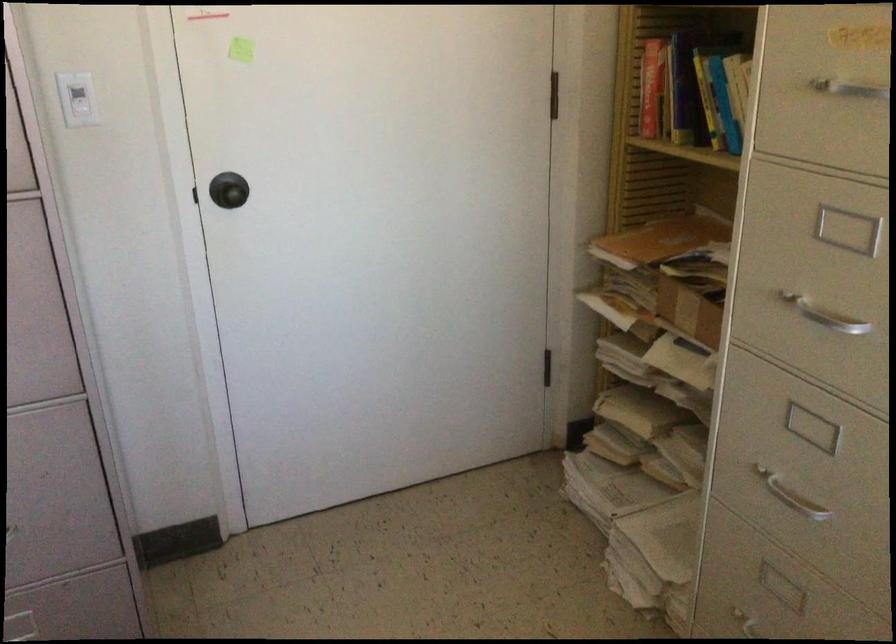
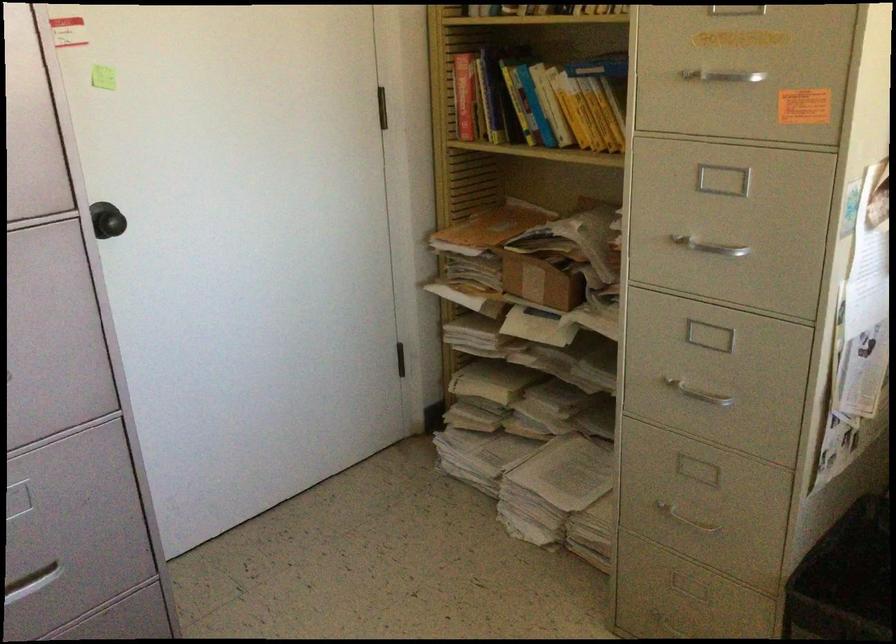
Find the pixel in the second image that matches pixel 233 196 in the first image.

(115, 223)